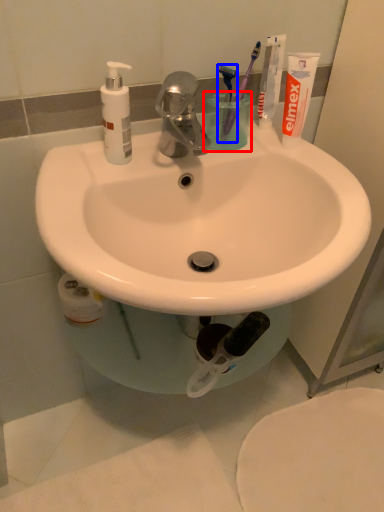
Question: Which object appears farthest to the camera in this image, liquid (highlighted by a red box) or toothbrush (highlighted by a blue box)?

Choices:
 (A) liquid
 (B) toothbrush

Answer: (A)